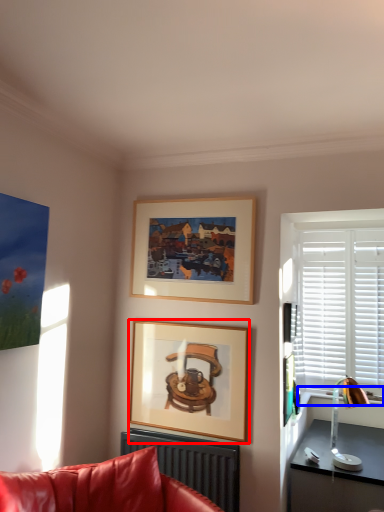
Question: Which point is further to the camera, picture frame (highlighted by a red box) or window sill (highlighted by a blue box)?

Choices:
 (A) picture frame
 (B) window sill

Answer: (B)